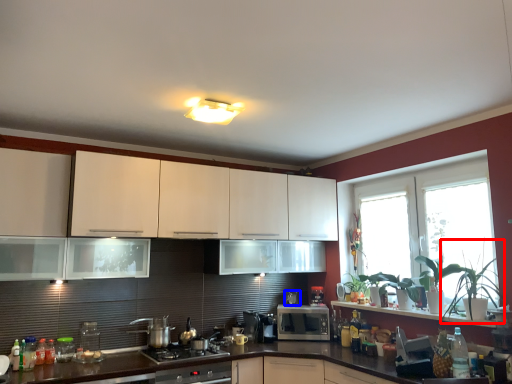
Question: Which point is closer to the camera, plant (highlighted by a red box) or appliance (highlighted by a blue box)?

Choices:
 (A) plant
 (B) appliance

Answer: (A)